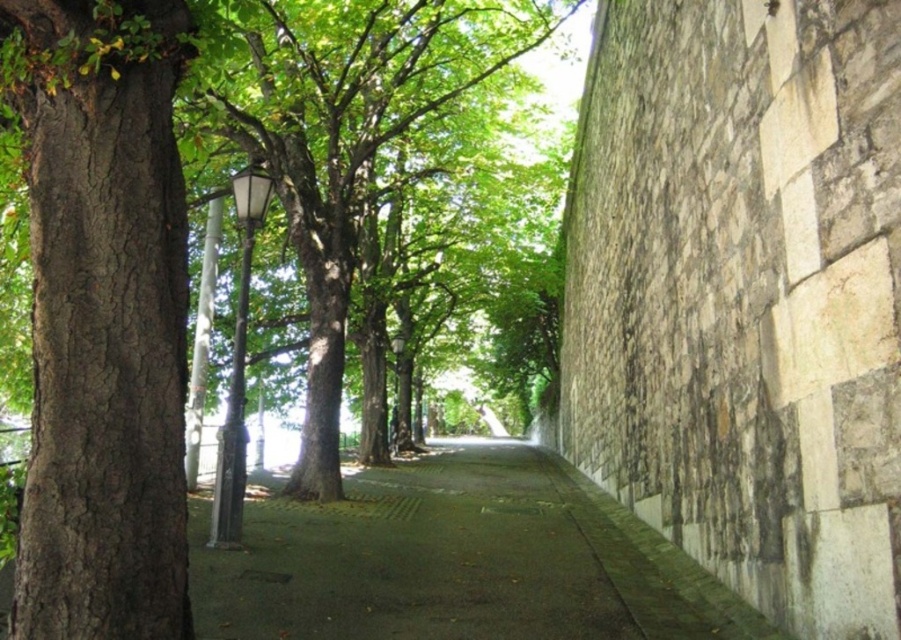
You are walking along the pathway and notice the brown rough bark tree at left and the green concrete pavement at center. Which object is positioned further to the east?

The brown rough bark tree at left is positioned further to the east because it is to the left of the green concrete pavement at center, and in the scene, the trees are on one side of the pathway which is likely the eastern side.

You are walking along the pathway and notice two trees ahead. The first is a brown rough bark tree at left, and the second is a green leafy tree at center. Which tree is closer to your current position?

The brown rough bark tree at left is closer to your current position because it is positioned on the left side of the green leafy tree at center, meaning it is nearer to you as you walk along the pathway.